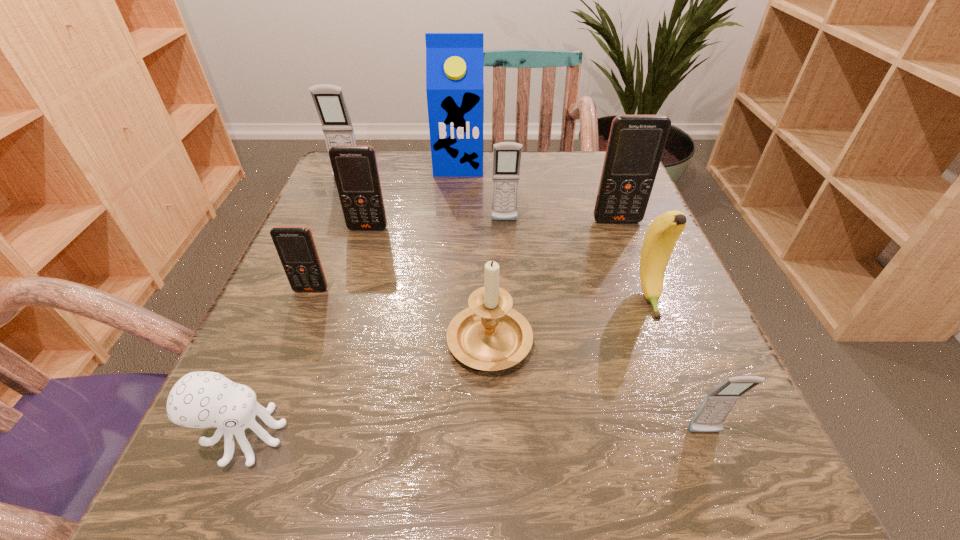
The image size is (960, 540). In order to click on object that is the fourth nearest to the second smallest orange cellular telephone in this screenshot , I will do `click(506, 155)`.

This screenshot has height=540, width=960. In order to click on the sixth closest cellular telephone to the banana in this screenshot , I will do `click(329, 100)`.

The height and width of the screenshot is (540, 960). Identify the location of cellular telephone that is the closest one to the second biggest gray cellular telephone. (636, 143).

Select which gray cellular telephone appears as the second closest to the second farthest orange cellular telephone. Please provide its 2D coordinates. Your answer should be formatted as a tuple, i.e. [(x, y)], where the tuple contains the x and y coordinates of a point satisfying the conditions above.

[(506, 155)]

Select which gray cellular telephone is the second closest to the biggest orange cellular telephone. Please provide its 2D coordinates. Your answer should be formatted as a tuple, i.e. [(x, y)], where the tuple contains the x and y coordinates of a point satisfying the conditions above.

[(716, 406)]

Where is `the third closest orange cellular telephone relative to the rightmost gray cellular telephone`? the third closest orange cellular telephone relative to the rightmost gray cellular telephone is located at coordinates (355, 169).

Identify which orange cellular telephone is located as the nearest to the tallest object. Please provide its 2D coordinates. Your answer should be formatted as a tuple, i.e. [(x, y)], where the tuple contains the x and y coordinates of a point satisfying the conditions above.

[(355, 169)]

I want to click on blank space that satisfies the following two spatial constraints: 1. on the screen of the rightmost orange cellular telephone; 2. on the front-facing side of the octopus, so click(x=700, y=436).

I want to click on free location that satisfies the following two spatial constraints: 1. on the front-facing side of the rightmost gray cellular telephone; 2. on the front-facing side of the white octopus, so click(706, 436).